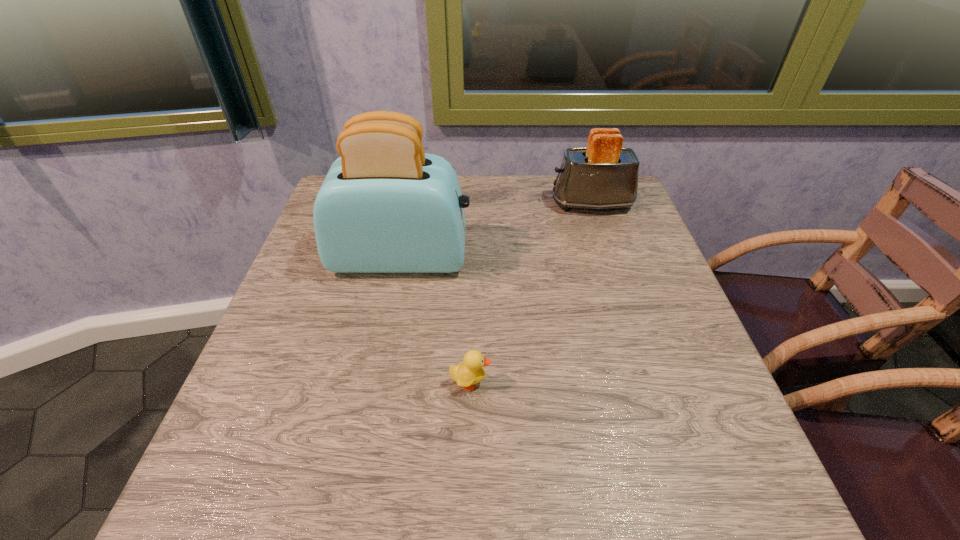
At what (x,y) coordinates should I click in order to perform the action: click on free spot between the second shortest object and the nearest object. Please return your answer as a coordinate pair (x, y). This screenshot has height=540, width=960. Looking at the image, I should click on (532, 293).

At what (x,y) coordinates should I click in order to perform the action: click on vacant space that is in between the farther toaster and the nearer toaster. Please return your answer as a coordinate pair (x, y). Image resolution: width=960 pixels, height=540 pixels. Looking at the image, I should click on (497, 231).

Where is `empty space that is in between the nearest object and the farther toaster`? empty space that is in between the nearest object and the farther toaster is located at coordinates (532, 293).

Locate an element on the screen. This screenshot has height=540, width=960. free spot between the farthest object and the tallest object is located at coordinates (497, 231).

This screenshot has height=540, width=960. In order to click on empty space between the shortest object and the taller toaster in this screenshot , I will do `click(436, 320)`.

Locate an element on the screen. vacant area between the shorter toaster and the tallest object is located at coordinates (497, 231).

Find the location of a particular element. The height and width of the screenshot is (540, 960). free space between the nearest object and the nearer toaster is located at coordinates (436, 320).

This screenshot has height=540, width=960. I want to click on vacant space that's between the right toaster and the left toaster, so click(497, 231).

The image size is (960, 540). I want to click on free space between the shortest object and the nearer toaster, so click(x=436, y=320).

At what (x,y) coordinates should I click in order to perform the action: click on vacant area that lies between the tallest object and the rightmost object. Please return your answer as a coordinate pair (x, y). Looking at the image, I should click on (497, 231).